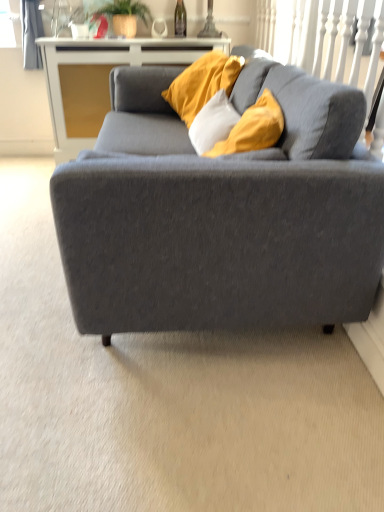
Question: From the image's perspective, is white glossy cabinet at upper center on top of green leafy plant at upper center?

Choices:
 (A) no
 (B) yes

Answer: (A)

Question: Is white glossy cabinet at upper center not near green leafy plant at upper center?

Choices:
 (A) yes
 (B) no

Answer: (B)

Question: Considering the relative sizes of white glossy cabinet at upper center and green leafy plant at upper center in the image provided, is white glossy cabinet at upper center taller than green leafy plant at upper center?

Choices:
 (A) no
 (B) yes

Answer: (B)

Question: Is white glossy cabinet at upper center turned away from green leafy plant at upper center?

Choices:
 (A) yes
 (B) no

Answer: (B)

Question: Does white glossy cabinet at upper center have a lesser width compared to green leafy plant at upper center?

Choices:
 (A) yes
 (B) no

Answer: (A)

Question: Is white glossy cabinet at upper center aimed at green leafy plant at upper center?

Choices:
 (A) yes
 (B) no

Answer: (B)

Question: Is green leafy plant at upper center at the left side of matte gray couch at center?

Choices:
 (A) no
 (B) yes

Answer: (B)

Question: From a real-world perspective, is green leafy plant at upper center positioned under matte gray couch at center based on gravity?

Choices:
 (A) yes
 (B) no

Answer: (B)

Question: Is green leafy plant at upper center positioned before matte gray couch at center?

Choices:
 (A) no
 (B) yes

Answer: (A)

Question: Is green leafy plant at upper center in contact with matte gray couch at center?

Choices:
 (A) yes
 (B) no

Answer: (B)

Question: Is green leafy plant at upper center wider than matte gray couch at center?

Choices:
 (A) yes
 (B) no

Answer: (B)

Question: Can you confirm if green leafy plant at upper center is thinner than matte gray couch at center?

Choices:
 (A) yes
 (B) no

Answer: (A)

Question: Does green glass wine bottle at upper center appear on the left side of matte gray couch at center?

Choices:
 (A) yes
 (B) no

Answer: (A)